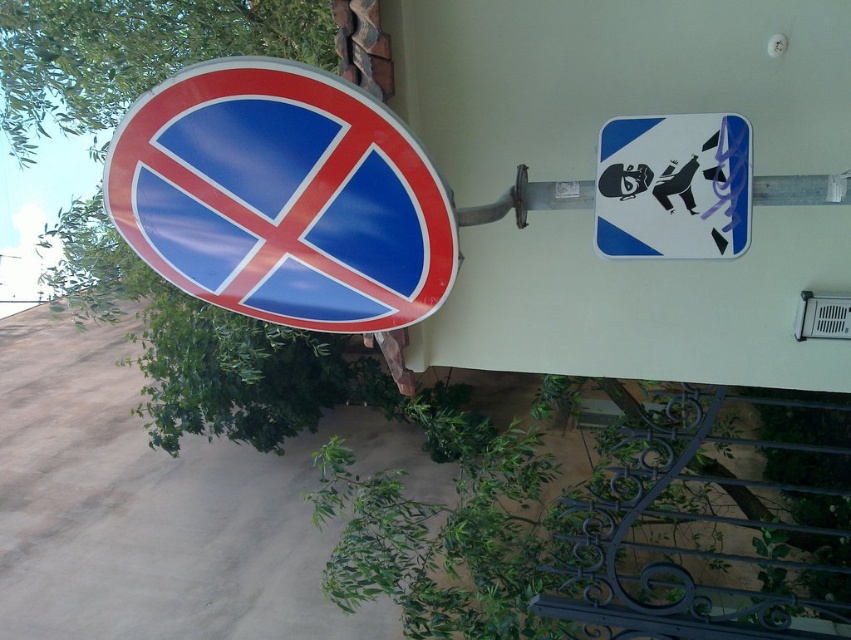
Does shiny plastic sign at left appear on the right side of blue glossy sign at upper right?

In fact, shiny plastic sign at left is to the left of blue glossy sign at upper right.

This screenshot has width=851, height=640. Identify the location of shiny plastic sign at left. (283, 196).

Identify the location of shiny plastic sign at left. (283, 196).

From the picture: Can you confirm if shiny plastic sign at left is thinner than metallic pole at upper right?

No, shiny plastic sign at left is not thinner than metallic pole at upper right.

The height and width of the screenshot is (640, 851). What do you see at coordinates (283, 196) in the screenshot? I see `shiny plastic sign at left` at bounding box center [283, 196].

Which is behind, point (146, 148) or point (567, 205)?

Positioned behind is point (567, 205).

Identify the location of shiny plastic sign at left. This screenshot has height=640, width=851. (283, 196).

Is blue glossy sign at upper right smaller than metallic pole at upper right?

Yes, blue glossy sign at upper right is smaller than metallic pole at upper right.

Which is below, blue glossy sign at upper right or metallic pole at upper right?

metallic pole at upper right

Does point (650, 253) lie behind point (555, 192)?

No, it is not.

Identify the location of blue glossy sign at upper right. (672, 186).